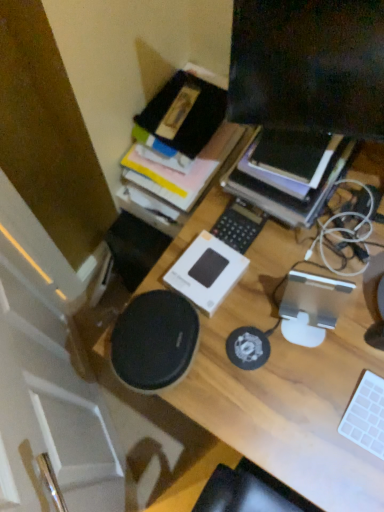
What are the coordinates of `empty space that is ontop of black matte book at upper right` in the screenshot? It's located at (293, 151).